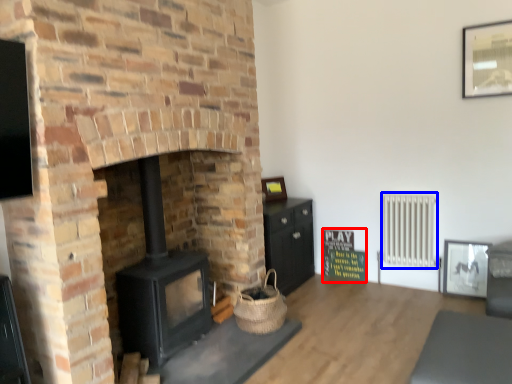
Question: Which of the following is the closest to the observer, bulletin board (highlighted by a red box) or radiator (highlighted by a blue box)?

Choices:
 (A) bulletin board
 (B) radiator

Answer: (B)